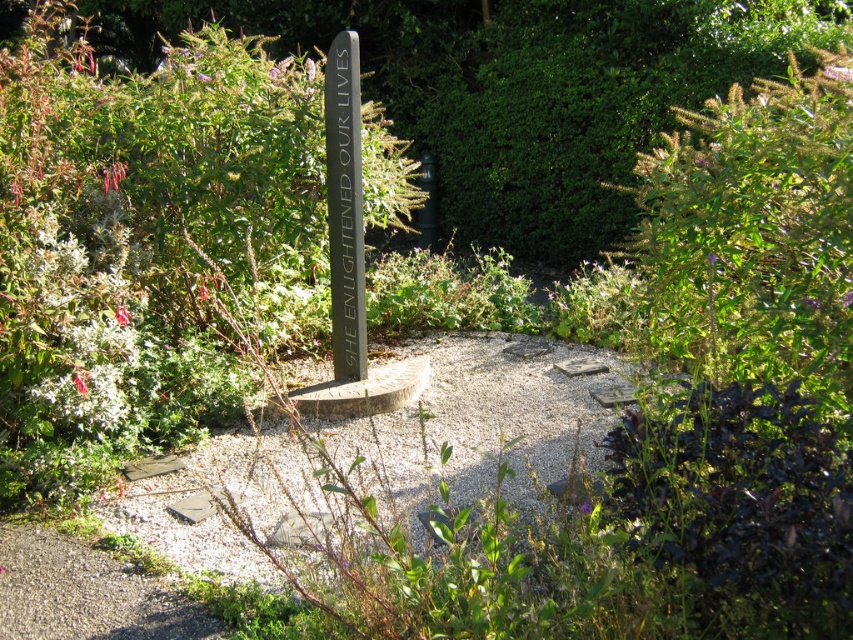
You are standing in the garden and see both the black polished stone sign at center and the black polished stone marker at center. Which one is positioned to the left?

The black polished stone sign at center is positioned to the left of the black polished stone marker at center.